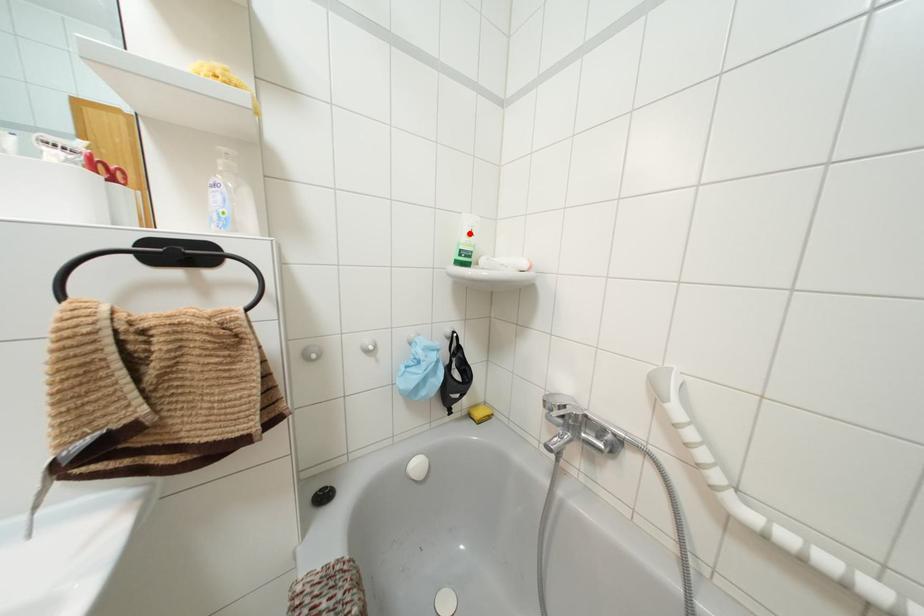
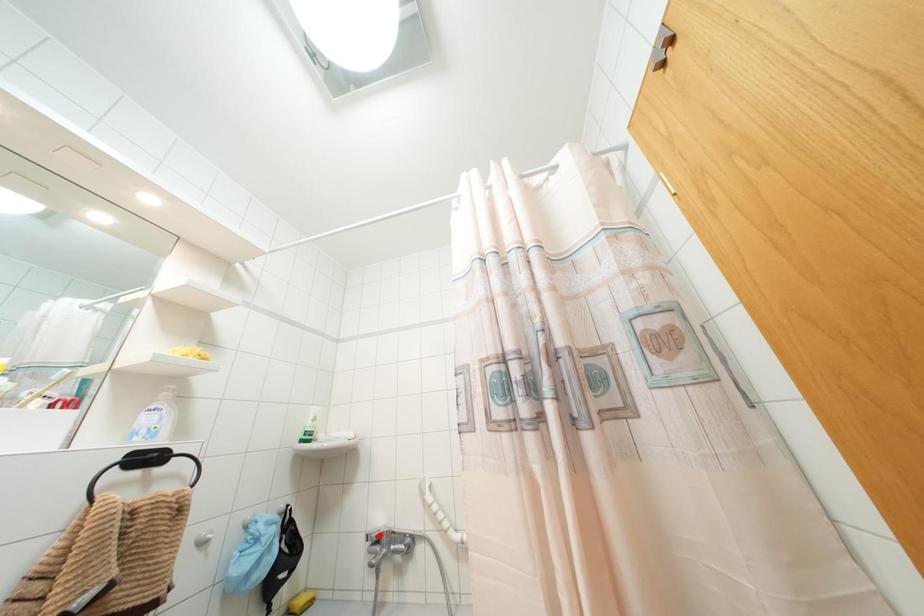
I am providing you with two images of the same scene from different viewpoints. A red point is marked on the first image and another point is marked on the second image. Does the point marked in image1 correspond to the same location as the one in image2?

No